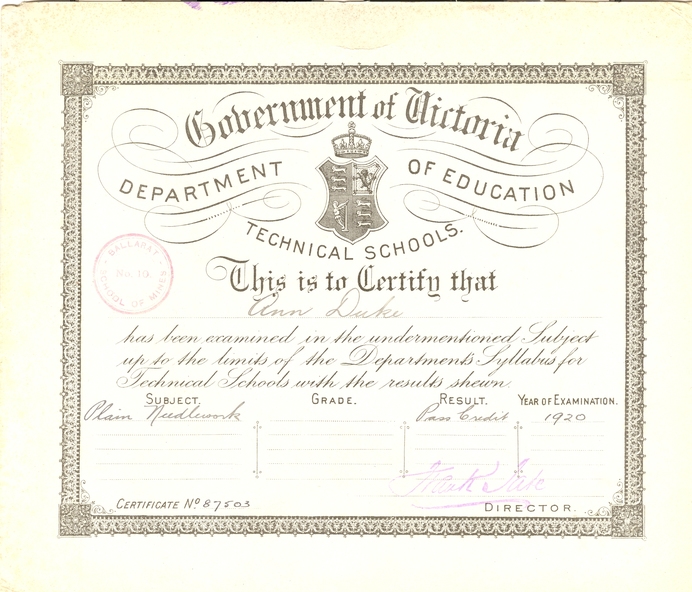
The image size is (692, 592). I want to click on top left border of certificate, so click(x=77, y=78).